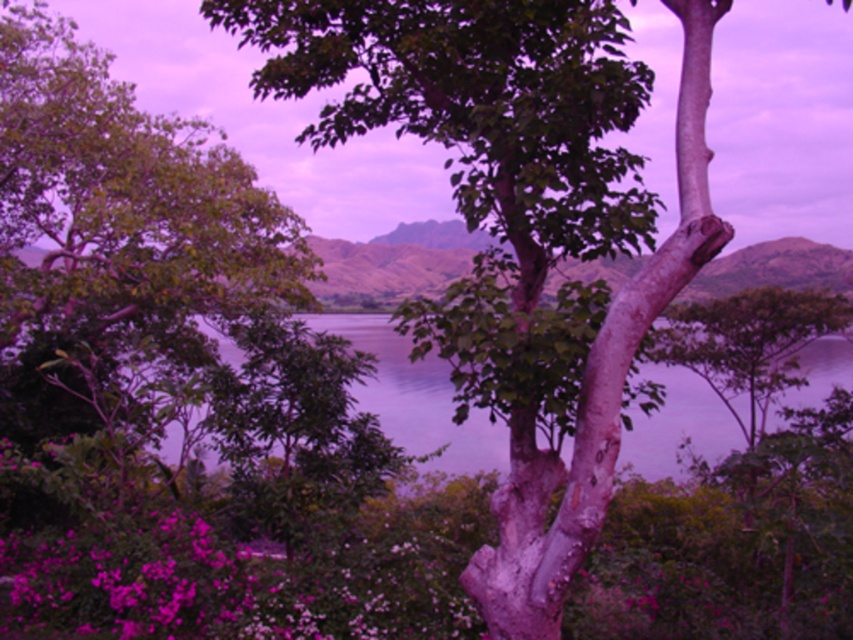
Question: Is pink matte flowers at lower left to the left of smooth bark tree at center from the viewer's perspective?

Choices:
 (A) no
 (B) yes

Answer: (B)

Question: Which object appears farthest from the camera in this image?

Choices:
 (A) smooth bark tree at center
 (B) pink matte flowers at lower left

Answer: (A)

Question: Does pink matte flowers at lower left have a smaller size compared to smooth bark tree at center?

Choices:
 (A) no
 (B) yes

Answer: (B)

Question: Which point appears closest to the camera in this image?

Choices:
 (A) (70, 557)
 (B) (729, 369)

Answer: (A)

Question: Which object is closer to the camera taking this photo?

Choices:
 (A) smooth bark tree at center
 (B) pink matte flowers at lower left

Answer: (B)

Question: Where is pink matte flowers at lower left located in relation to smooth bark tree at center in the image?

Choices:
 (A) right
 (B) left

Answer: (B)